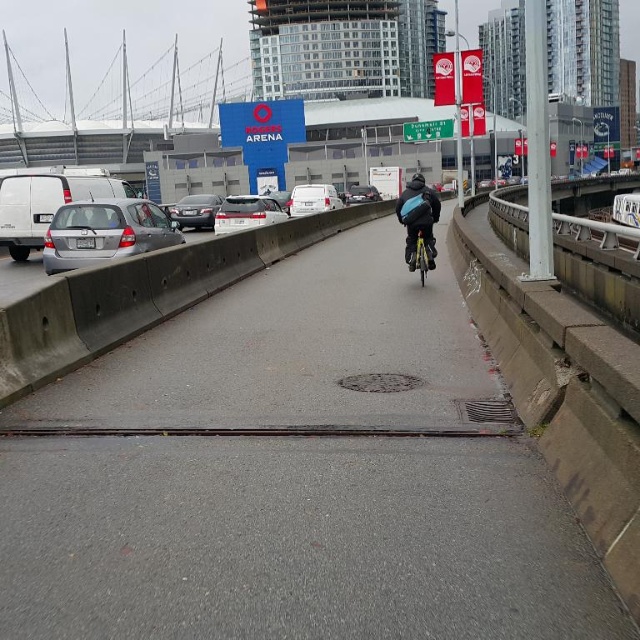
What do you see at coordinates (292, 476) in the screenshot?
I see `gray concrete highway at center` at bounding box center [292, 476].

Can you confirm if gray concrete highway at center is positioned to the left of shiny metallic bicycle at center?

Correct, you'll find gray concrete highway at center to the left of shiny metallic bicycle at center.

Between point (54, 627) and point (416, 248), which one is positioned behind?

Point (416, 248)

I want to click on gray concrete highway at center, so click(292, 476).

Which is behind, point (228, 205) or point (353, 196)?

Point (353, 196)

Which is more to the left, satin silver sedan at center or shiny silver car at center?

Positioned to the left is satin silver sedan at center.

Is point (214, 234) in front of point (358, 189)?

Yes, it is.

Where is `satin silver sedan at center`? Image resolution: width=640 pixels, height=640 pixels. satin silver sedan at center is located at coordinates (246, 212).

Can you confirm if satin silver sedan at center is shorter than satin silver sedan at left?

In fact, satin silver sedan at center may be taller than satin silver sedan at left.

Is satin silver sedan at center further to the viewer compared to satin silver sedan at left?

Yes.

In order to click on satin silver sedan at center in this screenshot , I will do `click(246, 212)`.